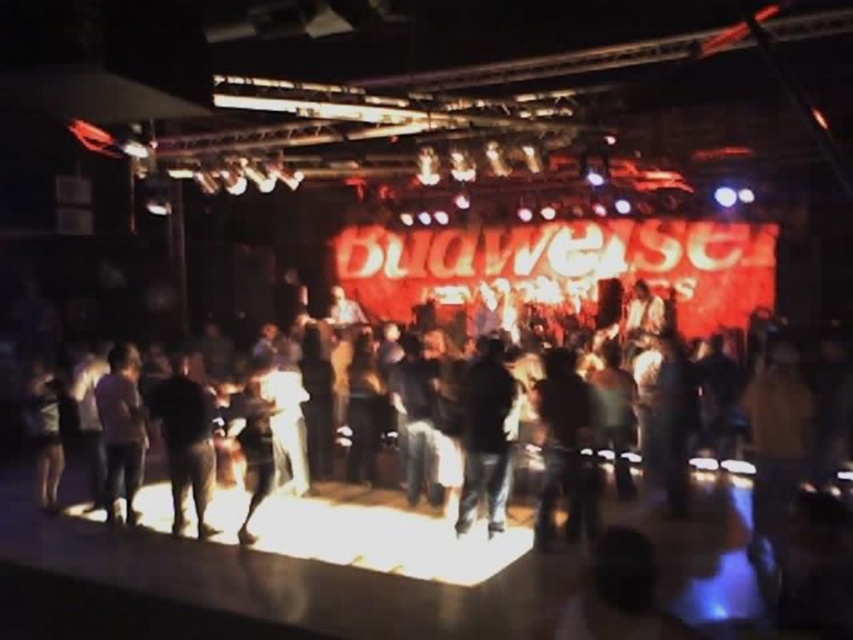
You are at the Budweiser event and want to take a photo of both the Budweiser sign and the crowd. You notice two points in the image labeled as point 1 at coordinates (630, 394) and point 2 at coordinates (42, 486). Which point should you focus on first to ensure both elements are in clear view?

You should focus on point 1 at coordinates (630, 394) first because it is closer to the camera than point 2 at coordinates (42, 486). This ensures that the closer point is in focus, and the farther point will also be within the depth of field, keeping both the Budweiser sign and the crowd clear.

You are a photographer at the event and want to capture a photo of the Budweiser sign in the background. You notice a person wearing dark fabric pants at lower left at point (186, 442). Will this person block your view of the Budweiser sign?

The dark fabric pants at lower left at point (186, 442) are located at the lower left position, which is below and to the left of the Budweiser sign in the background. Since the Budweiser sign is in the background, the person wearing dark fabric pants at lower left at point (186, 442) is unlikely to block the view of the Budweiser sign as they are positioned lower and to the side.